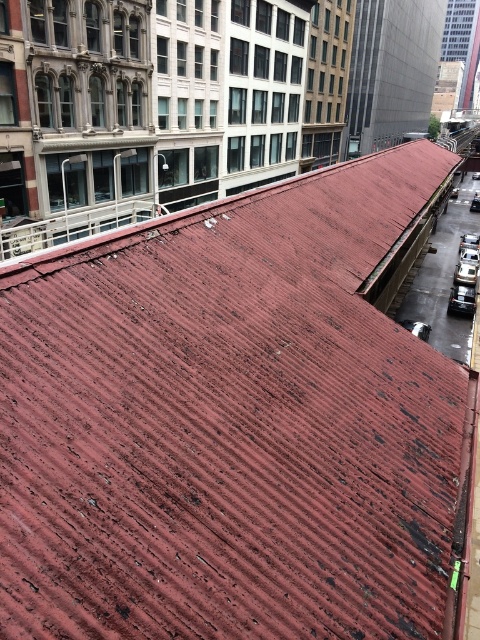
Is point (468, 292) farther from viewer compared to point (472, 282)?

No, it is not.

Which is in front, point (456, 296) or point (454, 275)?

Positioned in front is point (456, 296).

Find the location of a particular element. This screenshot has height=640, width=480. shiny silver car at lower right is located at coordinates (462, 300).